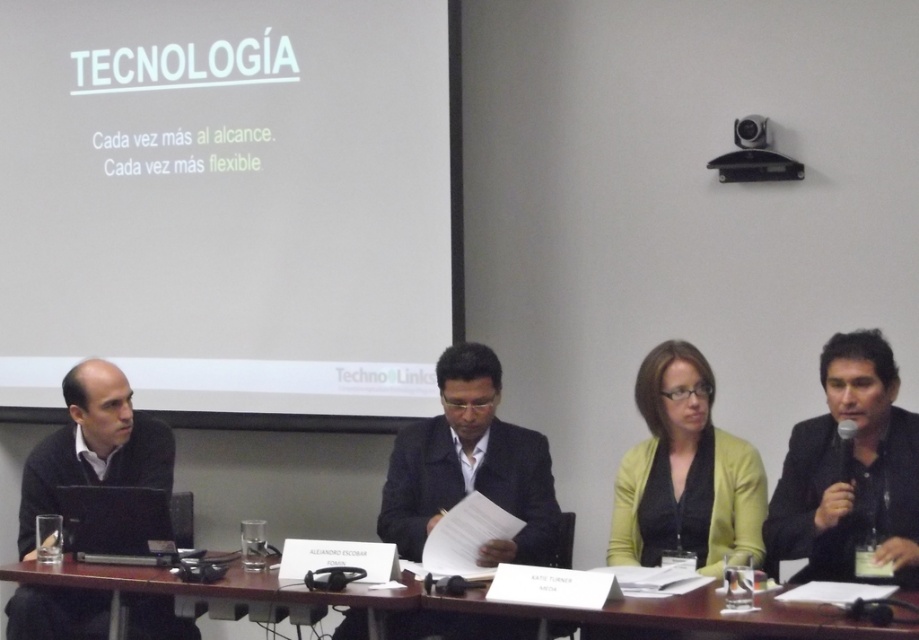
Who is positioned more to the right, matte green cardigan at center or black matte sweater at left?

Positioned to the right is matte green cardigan at center.

Is matte green cardigan at center further to the viewer compared to black matte sweater at left?

No, matte green cardigan at center is in front of black matte sweater at left.

From the picture: Who is more forward, (745, 492) or (7, 634)?

Point (745, 492) is in front.

The height and width of the screenshot is (640, 919). I want to click on matte green cardigan at center, so click(684, 472).

The width and height of the screenshot is (919, 640). What do you see at coordinates (231, 205) in the screenshot? I see `white matte projection screen at upper center` at bounding box center [231, 205].

Does white matte projection screen at upper center have a lesser height compared to matte black suit at center?

No.

Is point (96, 342) closer to camera compared to point (537, 472)?

That is False.

Find the location of a particular element. This screenshot has width=919, height=640. white matte projection screen at upper center is located at coordinates (231, 205).

In the scene shown: Is white matte projection screen at upper center to the right of black plastic camera at upper right from the viewer's perspective?

Incorrect, white matte projection screen at upper center is not on the right side of black plastic camera at upper right.

Which of these two, white matte projection screen at upper center or black plastic camera at upper right, stands taller?

With more height is white matte projection screen at upper center.

Is point (357, 44) farther from viewer compared to point (747, 145)?

That is True.

This screenshot has height=640, width=919. I want to click on white matte projection screen at upper center, so click(x=231, y=205).